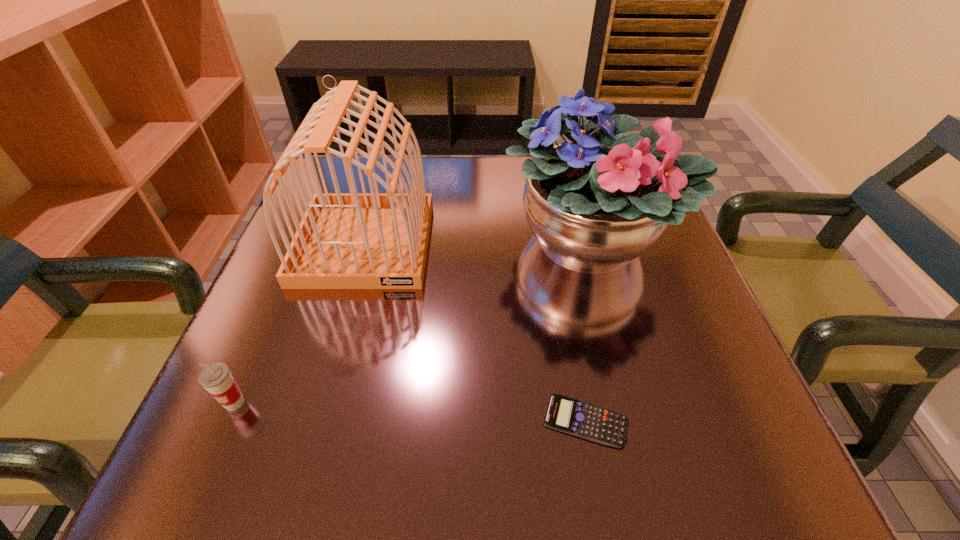
The height and width of the screenshot is (540, 960). I want to click on birdcage, so click(x=353, y=240).

Find the location of a particular element. Image resolution: width=960 pixels, height=540 pixels. bouquet is located at coordinates (595, 204).

Where is `cup`? The image size is (960, 540). cup is located at coordinates (216, 378).

Image resolution: width=960 pixels, height=540 pixels. Identify the location of calculator. (595, 423).

Locate an element on the screen. This screenshot has height=540, width=960. free spot located 0.060m with an open door on the birdcage is located at coordinates coord(345,313).

Identify the location of free spot located 0.360m on the left of the second tallest object. This screenshot has height=540, width=960. (330, 244).

Identify the location of blank space located on the side of the third tallest object with the logo. The width and height of the screenshot is (960, 540). (199, 485).

You are a GUI agent. You are given a task and a screenshot of the screen. Output one action in this format:
    pyautogui.click(x=<x>, y=<y>)
    Task: Click on the free spot located on the left of the shortest object
    The height and width of the screenshot is (540, 960).
    Given the screenshot: What is the action you would take?
    pyautogui.click(x=468, y=420)

Find the location of a particular element. The height and width of the screenshot is (540, 960). birdcage positioned at the far edge is located at coordinates (353, 240).

Find the location of a particular element. The height and width of the screenshot is (540, 960). bouquet present at the far edge is located at coordinates (595, 204).